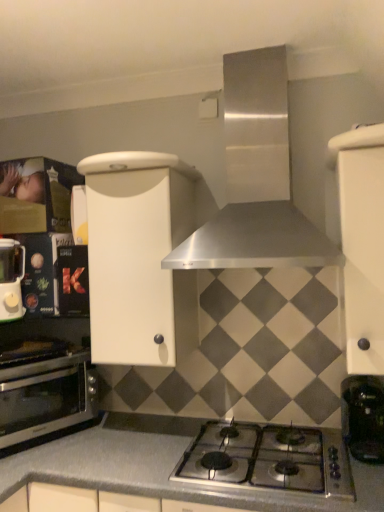
Where is `polished stainless steel gas stove at center`? polished stainless steel gas stove at center is located at coordinates (269, 459).

What do you see at coordinates (139, 257) in the screenshot?
I see `white matte cabinet at center, acting as the 2th cabinetry starting from the right` at bounding box center [139, 257].

The width and height of the screenshot is (384, 512). I want to click on stainless steel oven at lower left, so click(46, 397).

What do you see at coordinates (157, 467) in the screenshot? The image size is (384, 512). I see `gray matte countertop at lower center` at bounding box center [157, 467].

Measure the distance between point (346, 436) and camera.

The distance of point (346, 436) from camera is 5.30 feet.

What is the approximate height of black plastic coffee machine at lower right?

The height of black plastic coffee machine at lower right is 10.56 inches.

Image resolution: width=384 pixels, height=512 pixels. What are the coordinates of `stainless steel range hood at upper center` in the screenshot? It's located at (256, 179).

Where is `polished stainless steel gas stove at center`? polished stainless steel gas stove at center is located at coordinates click(269, 459).

Between black plastic coffee machine at lower right and white matte cabinet at center, which is counted as the first cabinetry, starting from the left, which one is positioned in front?

Positioned in front is black plastic coffee machine at lower right.

Is black plastic coffee machine at lower right not inside white matte cabinet at center, which is counted as the first cabinetry, starting from the left?

black plastic coffee machine at lower right is positioned outside white matte cabinet at center, which is counted as the first cabinetry, starting from the left.

Identify the location of coffee machine below the white matte cabinet at center, which is counted as the first cabinetry, starting from the left (from the image's perspective). (x=363, y=417).

Is black plastic coffee machine at lower right taller than white matte cabinet at center, acting as the 2th cabinetry starting from the right?

No.

There is a black plastic coffee machine at lower right. Where is `the 1st cabinetry above it (from the image's perspective)`? The image size is (384, 512). the 1st cabinetry above it (from the image's perspective) is located at coordinates (139, 257).

From a real-world perspective, relative to black plastic coffee machine at lower right, is white matte cabinet at center, which is counted as the first cabinetry, starting from the left, vertically above or below?

In terms of real-world spatial position, white matte cabinet at center, which is counted as the first cabinetry, starting from the left, is above black plastic coffee machine at lower right.

Considering the sizes of objects white matte cabinet at center, acting as the 2th cabinetry starting from the right, and black plastic coffee machine at lower right in the image provided, who is shorter, white matte cabinet at center, acting as the 2th cabinetry starting from the right, or black plastic coffee machine at lower right?

With less height is black plastic coffee machine at lower right.

Is white matte cabinet at center, which is counted as the first cabinetry, starting from the left, positioned with its back to black plastic coffee machine at lower right?

white matte cabinet at center, which is counted as the first cabinetry, starting from the left, is not turned away from black plastic coffee machine at lower right.

From a real-world perspective, relative to white matte cabinet at center, acting as the 2th cabinetry starting from the right, is matte white blender at left vertically above or below?

In terms of real-world spatial position, matte white blender at left is below white matte cabinet at center, acting as the 2th cabinetry starting from the right.

Consider the image. From the image's perspective, which is above, matte white blender at left or white matte cabinet at center, acting as the 2th cabinetry starting from the right?

From the image's view, white matte cabinet at center, acting as the 2th cabinetry starting from the right, is above.

Can you confirm if matte white blender at left is wider than white matte cabinet at center, which is counted as the first cabinetry, starting from the left?

No.

Find the location of `the 1st cabinetry in front of the matte white blender at left, counting from the anchor's position`. the 1st cabinetry in front of the matte white blender at left, counting from the anchor's position is located at coordinates (139, 257).

Are matte white blender at left and stainless steel oven at lower left located far from each other?

matte white blender at left is near stainless steel oven at lower left, not far away.

From the image's perspective, relative to stainless steel oven at lower left, is matte white blender at left above or below?

Clearly, from the image's perspective, matte white blender at left is above stainless steel oven at lower left.

Consider the image. Is the position of black plastic coffee machine at lower right more distant than that of stainless steel oven at lower left?

No, it is not.

Is black plastic coffee machine at lower right not near stainless steel oven at lower left?

Yes, black plastic coffee machine at lower right is far from stainless steel oven at lower left.

Between black plastic coffee machine at lower right and stainless steel oven at lower left, which one appears on the left side from the viewer's perspective?

stainless steel oven at lower left.

Is black plastic coffee machine at lower right wider than stainless steel oven at lower left?

Incorrect, the width of black plastic coffee machine at lower right does not surpass that of stainless steel oven at lower left.

Considering the positions of objects white matte cabinet at right, which is counted as the 2th cabinetry, starting from the left, and matte white blender at left in the image provided, who is behind, white matte cabinet at right, which is counted as the 2th cabinetry, starting from the left, or matte white blender at left?

matte white blender at left is further away from the camera.

Based on the photo, are white matte cabinet at right, which is counted as the 2th cabinetry, starting from the left, and matte white blender at left far apart?

Absolutely, white matte cabinet at right, which is counted as the 2th cabinetry, starting from the left, is distant from matte white blender at left.

Which is closer to the camera, (369, 252) or (22, 262)?

Point (369, 252).

From the image's perspective, between white matte cabinet at right, which ranks as the first cabinetry in right-to-left order, and matte white blender at left, which one is located above?

white matte cabinet at right, which ranks as the first cabinetry in right-to-left order.

Would you say polished stainless steel gas stove at center is outside black plastic coffee machine at lower right?

Yes, polished stainless steel gas stove at center is located beyond the bounds of black plastic coffee machine at lower right.

Is point (244, 478) positioned in front of point (359, 451)?

Yes, point (244, 478) is in front of point (359, 451).

Is the surface of polished stainless steel gas stove at center in direct contact with black plastic coffee machine at lower right?

polished stainless steel gas stove at center is not next to black plastic coffee machine at lower right, and they're not touching.

Considering the sizes of objects polished stainless steel gas stove at center and black plastic coffee machine at lower right in the image provided, who is wider, polished stainless steel gas stove at center or black plastic coffee machine at lower right?

With larger width is polished stainless steel gas stove at center.

Where is `the 2nd cabinetry to the left of the black plastic coffee machine at lower right, counting from the anchor's position`? The image size is (384, 512). the 2nd cabinetry to the left of the black plastic coffee machine at lower right, counting from the anchor's position is located at coordinates (139, 257).

The height and width of the screenshot is (512, 384). I want to click on coffee machine below the white matte cabinet at center, acting as the 2th cabinetry starting from the right (from the image's perspective), so click(363, 417).

When comparing their distances from stainless steel range hood at upper center, does stainless steel oven at lower left or white matte cabinet at right, which ranks as the first cabinetry in right-to-left order, seem further?

Based on the image, stainless steel oven at lower left appears to be further to stainless steel range hood at upper center.

Considering their positions, is polished stainless steel gas stove at center positioned closer to gray matte countertop at lower center than white matte cabinet at center, acting as the 2th cabinetry starting from the right?

The object closer to gray matte countertop at lower center is polished stainless steel gas stove at center.

Looking at the image, which one is located closer to white matte cabinet at right, which is counted as the 2th cabinetry, starting from the left, gray matte countertop at lower center or stainless steel range hood at upper center?

stainless steel range hood at upper center is closer to white matte cabinet at right, which is counted as the 2th cabinetry, starting from the left.

From the image, which object appears to be farther from white matte cabinet at center, acting as the 2th cabinetry starting from the right, stainless steel range hood at upper center or stainless steel oven at lower left?

The object further to white matte cabinet at center, acting as the 2th cabinetry starting from the right, is stainless steel oven at lower left.

When comparing their distances from gray matte countertop at lower center, does white matte cabinet at center, which is counted as the first cabinetry, starting from the left, or polished stainless steel gas stove at center seem further?

white matte cabinet at center, which is counted as the first cabinetry, starting from the left.

Considering their positions, is stainless steel oven at lower left positioned further to polished stainless steel gas stove at center than gray matte countertop at lower center?

The object further to polished stainless steel gas stove at center is stainless steel oven at lower left.

When comparing their distances from white matte cabinet at center, acting as the 2th cabinetry starting from the right, does gray matte countertop at lower center or white matte cabinet at right, which is counted as the 2th cabinetry, starting from the left, seem closer?

The object closer to white matte cabinet at center, acting as the 2th cabinetry starting from the right, is gray matte countertop at lower center.

From the picture: Considering their positions, is black plastic coffee machine at lower right positioned further to gray matte countertop at lower center than polished stainless steel gas stove at center?

black plastic coffee machine at lower right lies further to gray matte countertop at lower center than the other object.

Locate an element on the screen. gas stove between white matte cabinet at center, which is counted as the first cabinetry, starting from the left, and black plastic coffee machine at lower right is located at coordinates (269, 459).

The width and height of the screenshot is (384, 512). What are the coordinates of `oven between stainless steel range hood at upper center and polished stainless steel gas stove at center in the vertical direction` in the screenshot? It's located at (46, 397).

Where is `gas stove situated between stainless steel oven at lower left and white matte cabinet at right, which is counted as the 2th cabinetry, starting from the left, from left to right`? gas stove situated between stainless steel oven at lower left and white matte cabinet at right, which is counted as the 2th cabinetry, starting from the left, from left to right is located at coordinates (269, 459).

Locate an element on the screen. The width and height of the screenshot is (384, 512). oven between matte white blender at left and white matte cabinet at right, which is counted as the 2th cabinetry, starting from the left is located at coordinates (46, 397).